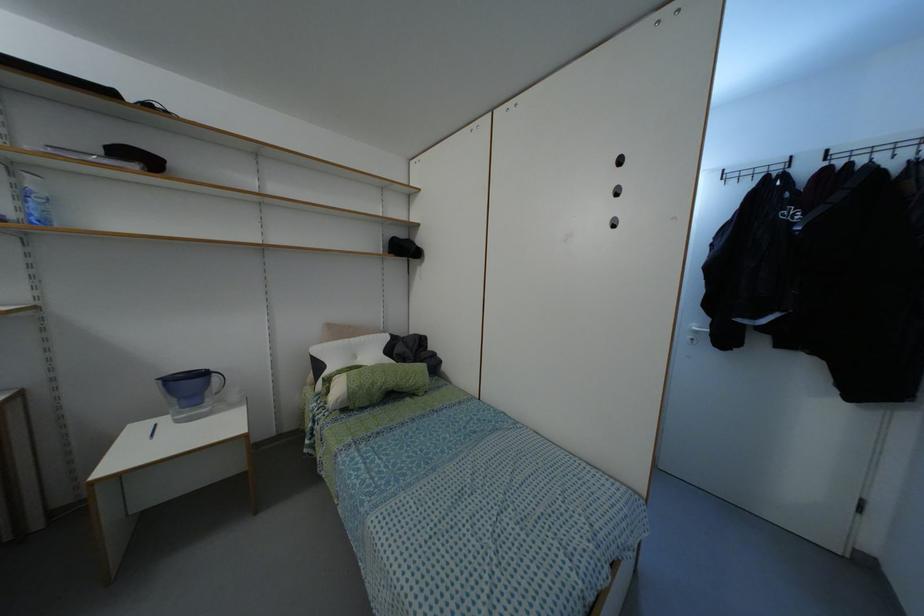
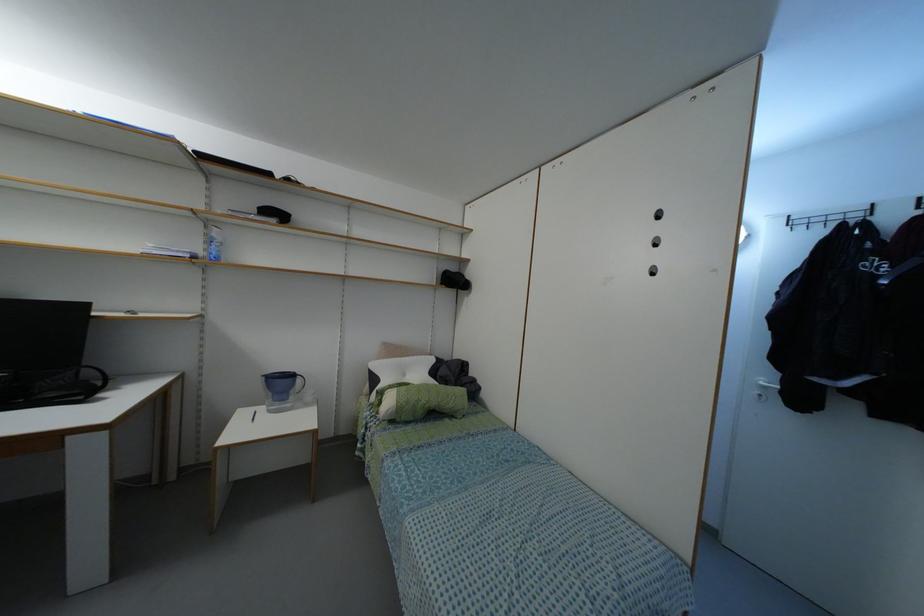
Locate, in the second image, the point that corresponds to pixel 696 331 in the first image.

(763, 387)